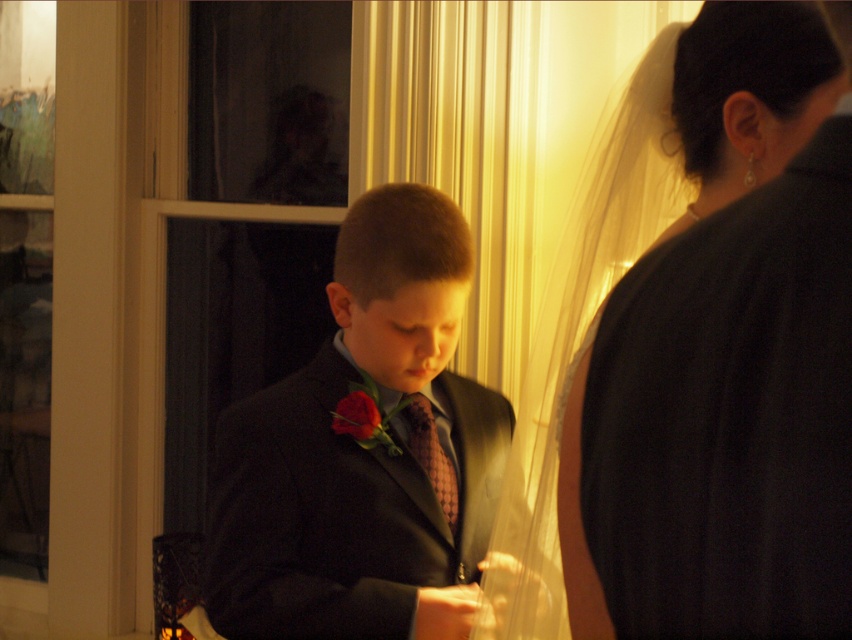
The image size is (852, 640). Identify the location of silky white veil at upper right. (649, 236).

Does point (691, 54) come closer to viewer compared to point (424, 419)?

Yes, point (691, 54) is closer to viewer.

This screenshot has height=640, width=852. I want to click on silky white veil at upper right, so click(x=649, y=236).

In the scene shown: Who is shorter, shiny black suit at center or silky white veil at upper right?

Standing shorter between the two is shiny black suit at center.

Does shiny black suit at center come in front of silky white veil at upper right?

No.

Find the location of a particular element. Image resolution: width=852 pixels, height=640 pixels. shiny black suit at center is located at coordinates (366, 451).

Looking at this image, does shiny black suit at center have a larger size compared to pink textured tie at center?

Yes, shiny black suit at center is bigger than pink textured tie at center.

Who is more forward, (440, 308) or (413, 449)?

Point (440, 308) is in front.

Is point (251, 612) positioned after point (404, 410)?

No, (251, 612) is closer to viewer.

Where is `shiny black suit at center`? shiny black suit at center is located at coordinates (366, 451).